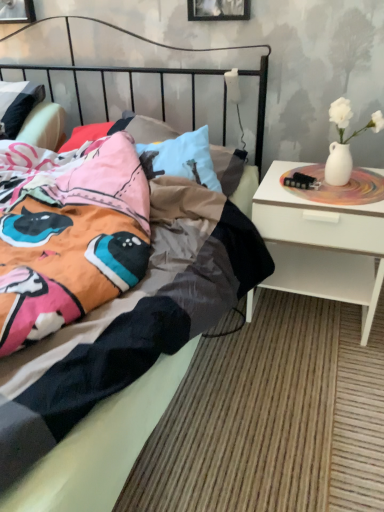
Identify the location of blank space above white glossy nightstand at right (from a real-world perspective). This screenshot has width=384, height=512. (339, 181).